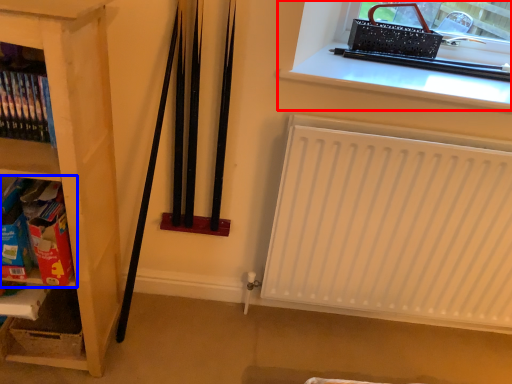
Question: Which object is further to the camera taking this photo, window (highlighted by a red box) or shelf (highlighted by a blue box)?

Choices:
 (A) window
 (B) shelf

Answer: (A)